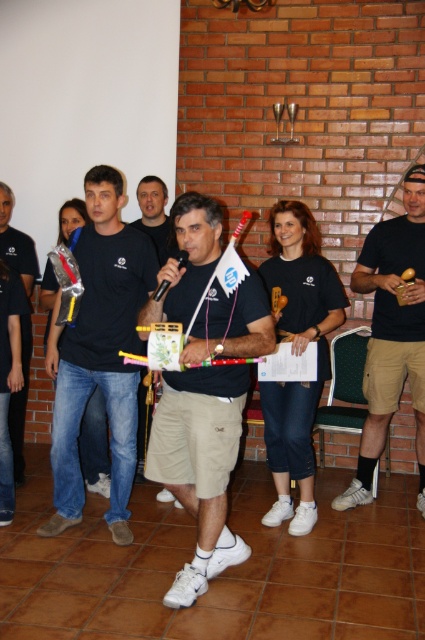
You are an event photographer at the indoor gathering. You need to capture a photo of the black cotton shirt at center and the wooden maraca at center. Which object should you focus on first if you want to ensure both are in frame without moving the camera?

The black cotton shirt at center is taller than the wooden maraca at center, so you should focus on the black cotton shirt at center first to ensure both are in frame without moving the camera.

Based on the scene description, can you determine the spatial relationship between the matte khaki shorts at center and the matte black shirt at center?

The matte khaki shorts at center are located below the matte black shirt at center.